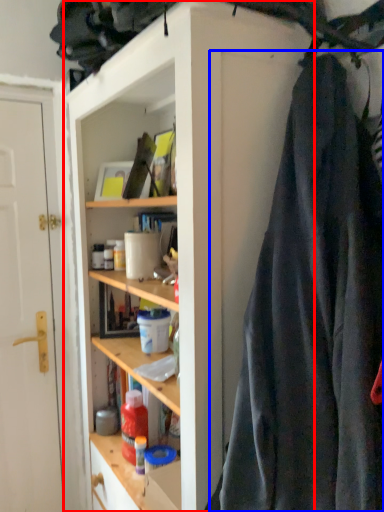
Question: Which of the following is the farthest to the observer, cabinetry (highlighted by a red box) or clothing (highlighted by a blue box)?

Choices:
 (A) cabinetry
 (B) clothing

Answer: (A)